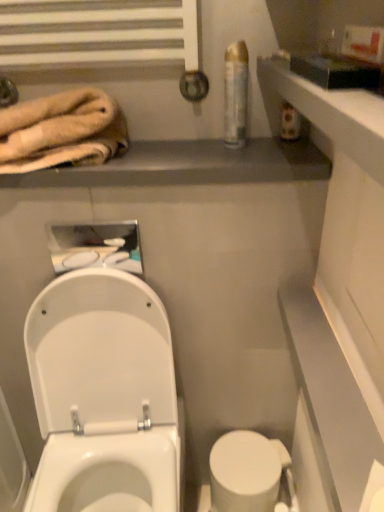
The height and width of the screenshot is (512, 384). Identify the location of free spot above metallic gray balustrade at upper center (from a real-world perspective). (187, 153).